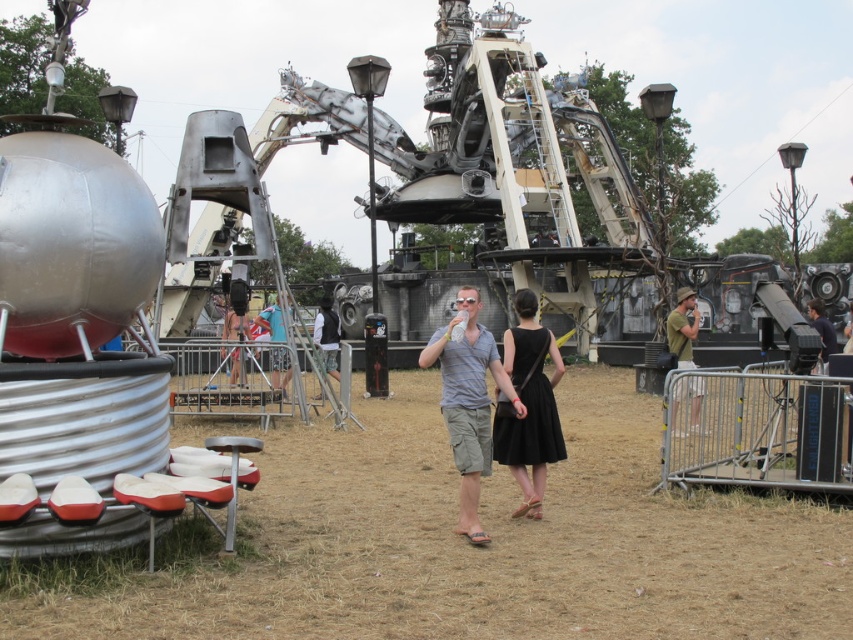
Is point (555, 516) positioned in front of point (827, 352)?

That is True.

Does brown dry grass at center lie behind dark blue shirt at center?

No, it is not.

Where is `brown dry grass at center`? Image resolution: width=853 pixels, height=640 pixels. brown dry grass at center is located at coordinates [459, 541].

Is matte gray shirt at center positioned at the back of black satin dress at center?

No, matte gray shirt at center is closer to the viewer.

Is matte gray shirt at center wider than black satin dress at center?

No.

What are the coordinates of `matte gray shirt at center` in the screenshot? It's located at (469, 401).

Between green matte shirt at right and white shirt at center, which one is positioned lower?

green matte shirt at right

Where is `green matte shirt at right`? The height and width of the screenshot is (640, 853). green matte shirt at right is located at coordinates (682, 326).

Is point (672, 349) positioned in front of point (331, 356)?

That is True.

Find the location of a particular element. Image resolution: width=853 pixels, height=640 pixels. green matte shirt at right is located at coordinates (682, 326).